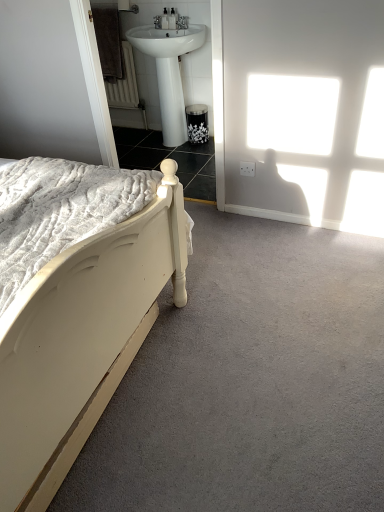
Question: In terms of height, does white painted wood bed at left look taller or shorter compared to black metal towel bar at upper center?

Choices:
 (A) short
 (B) tall

Answer: (B)

Question: Is white painted wood bed at left situated inside black metal towel bar at upper center or outside?

Choices:
 (A) inside
 (B) outside

Answer: (B)

Question: Which is farther from the white painted wood bed at left?

Choices:
 (A) white glossy sink at upper center
 (B) black metal towel bar at upper center

Answer: (B)

Question: Estimate the real-world distances between objects in this image. Which object is closer to the white glossy sink at upper center?

Choices:
 (A) black metal towel bar at upper center
 (B) white painted wood bed at left

Answer: (A)